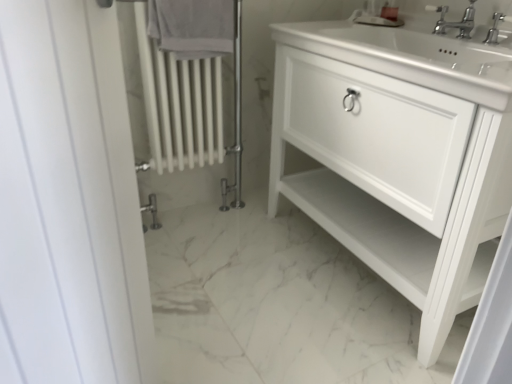
Question: From the image's perspective, is white cotton towel at upper center located beneath polished chrome faucet at upper right, the first tap viewed from the right?

Choices:
 (A) no
 (B) yes

Answer: (A)

Question: Is white cotton towel at upper center positioned in front of polished chrome faucet at upper right, the first tap viewed from the right?

Choices:
 (A) no
 (B) yes

Answer: (A)

Question: Does white cotton towel at upper center have a greater width compared to polished chrome faucet at upper right, the first tap viewed from the right?

Choices:
 (A) yes
 (B) no

Answer: (A)

Question: Considering the relative positions of white cotton towel at upper center and polished chrome faucet at upper right, positioned as the second tap in left-to-right order, in the image provided, is white cotton towel at upper center to the left of polished chrome faucet at upper right, positioned as the second tap in left-to-right order, from the viewer's perspective?

Choices:
 (A) no
 (B) yes

Answer: (B)

Question: Can you confirm if white cotton towel at upper center is positioned to the right of polished chrome faucet at upper right, the first tap viewed from the right?

Choices:
 (A) no
 (B) yes

Answer: (A)

Question: Considering the positions of clear plastic soap dispenser at upper center and polished chrome faucet at upper right, positioned as the second tap in left-to-right order, in the image, is clear plastic soap dispenser at upper center wider or thinner than polished chrome faucet at upper right, positioned as the second tap in left-to-right order,?

Choices:
 (A) wide
 (B) thin

Answer: (B)

Question: Is clear plastic soap dispenser at upper center spatially inside polished chrome faucet at upper right, the first tap viewed from the right, or outside of it?

Choices:
 (A) outside
 (B) inside

Answer: (A)

Question: In the image, is clear plastic soap dispenser at upper center positioned in front of or behind polished chrome faucet at upper right, the first tap viewed from the right?

Choices:
 (A) front
 (B) behind

Answer: (B)

Question: Visually, is clear plastic soap dispenser at upper center positioned to the left or to the right of polished chrome faucet at upper right, the first tap viewed from the right?

Choices:
 (A) right
 (B) left

Answer: (B)

Question: Would you say polished chrome faucet at upper right, the first tap viewed from the right, is to the left or to the right of white cotton towel at upper center in the picture?

Choices:
 (A) left
 (B) right

Answer: (B)

Question: Is polished chrome faucet at upper right, positioned as the second tap in left-to-right order, inside or outside of white cotton towel at upper center?

Choices:
 (A) outside
 (B) inside

Answer: (A)

Question: Considering their positions, is polished chrome faucet at upper right, positioned as the second tap in left-to-right order, located in front of or behind white cotton towel at upper center?

Choices:
 (A) behind
 (B) front

Answer: (B)

Question: From a real-world perspective, relative to white cotton towel at upper center, is polished chrome faucet at upper right, the first tap viewed from the right, vertically above or below?

Choices:
 (A) below
 (B) above

Answer: (B)

Question: Considering their positions, is white cotton towel at upper center located in front of or behind white matte cabinet at center?

Choices:
 (A) behind
 (B) front

Answer: (A)

Question: Considering the positions of white cotton towel at upper center and white matte cabinet at center in the image, is white cotton towel at upper center taller or shorter than white matte cabinet at center?

Choices:
 (A) short
 (B) tall

Answer: (A)